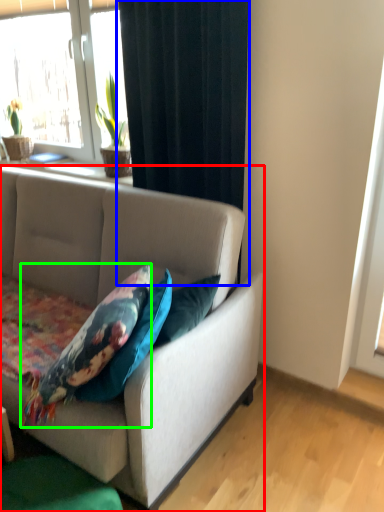
Question: Considering the real-world distances, which object is closest to studio couch (highlighted by a red box)? curtain (highlighted by a blue box) or pillow (highlighted by a green box).

Choices:
 (A) curtain
 (B) pillow

Answer: (B)